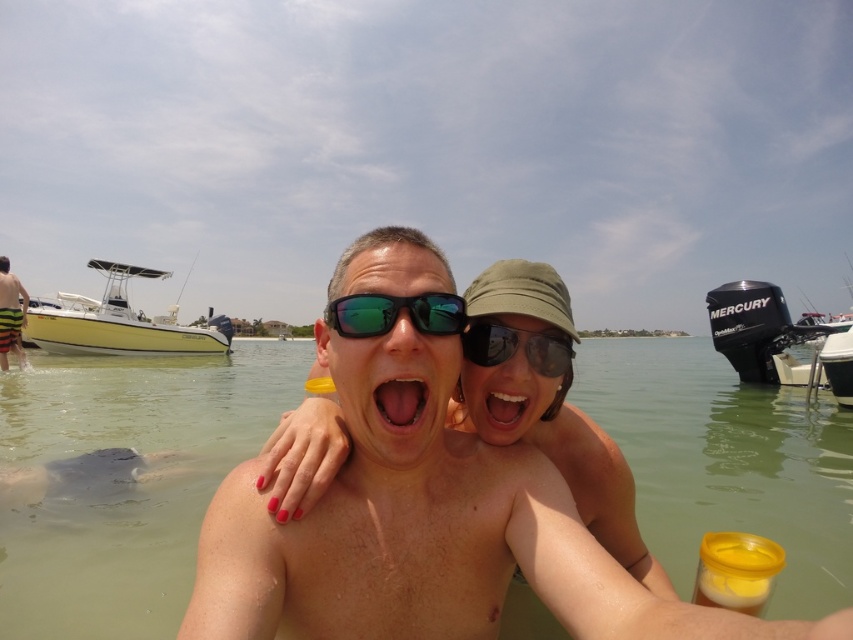
Question: Which of the following is the closest to the observer?

Choices:
 (A) clear water at center
 (B) pink glossy tongue at center
 (C) shiny black sunglasses at center

Answer: (B)

Question: Which point is closer to the camera taking this photo?

Choices:
 (A) (727, 353)
 (B) (91, 324)
 (C) (494, 406)
 (D) (544, 346)

Answer: (D)

Question: Does yellow matte boat at left have a lesser width compared to yellow striped shorts at left?

Choices:
 (A) yes
 (B) no

Answer: (A)

Question: Is black metallic motorboat at right in front of yellow matte boat at left?

Choices:
 (A) yes
 (B) no

Answer: (A)

Question: Among these points, which one is nearest to the camera?

Choices:
 (A) (734, 349)
 (B) (4, 292)
 (C) (497, 417)
 (D) (486, 355)

Answer: (D)

Question: Can you confirm if black metallic motorboat at right is bigger than green reflective plastic goggles at center?

Choices:
 (A) no
 (B) yes

Answer: (B)